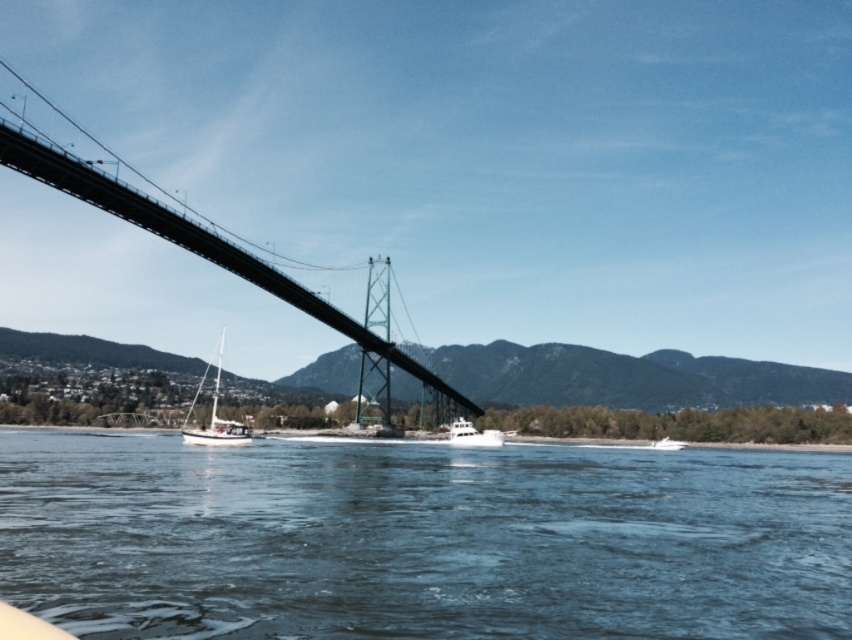
Is the position of blue water at center more distant than that of white matte sailboat at lower left?

That is False.

Does point (200, 484) come closer to viewer compared to point (205, 440)?

Yes, it is in front of point (205, 440).

Which is behind, point (689, 600) or point (216, 433)?

Point (216, 433)

Locate an element on the screen. The height and width of the screenshot is (640, 852). blue water at center is located at coordinates (421, 540).

Which of these two, blue water at center or green metallic suspension bridge at center, stands taller?

green metallic suspension bridge at center is taller.

Between point (338, 531) and point (332, 305), which one is positioned in front?

Positioned in front is point (338, 531).

You are a GUI agent. You are given a task and a screenshot of the screen. Output one action in this format:
    pyautogui.click(x=<x>, y=<y>)
    Task: Click on the blue water at center
    
    Given the screenshot: What is the action you would take?
    pyautogui.click(x=421, y=540)

Can you confirm if white matte sailboat at lower left is bigger than white matte boat at center?

Yes.

Is point (240, 432) positioned in front of point (463, 420)?

Yes, point (240, 432) is closer to viewer.

Which is behind, point (222, 346) or point (494, 440)?

The point (222, 346) is more distant.

Where is `white matte sailboat at lower left`? This screenshot has height=640, width=852. white matte sailboat at lower left is located at coordinates (214, 417).